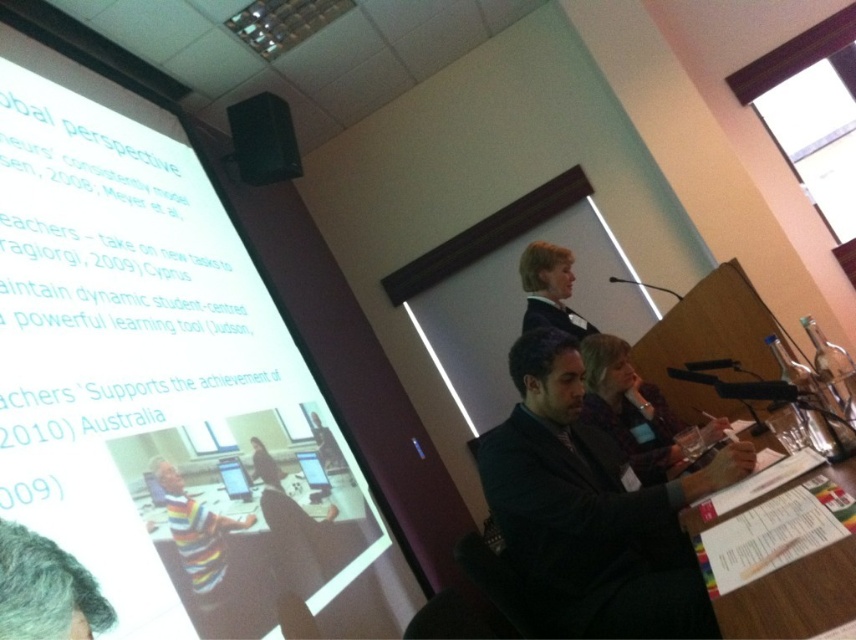
Question: Is plaid fabric shirt at center positioned at the back of black fabric business suit at upper center?

Choices:
 (A) yes
 (B) no

Answer: (B)

Question: Which object is positioned closest to the plaid fabric shirt at center?

Choices:
 (A) matte black laptop at center
 (B) green fuzzy hair at upper left
 (C) white matte projection screen at upper left

Answer: (A)

Question: Which of the following is the closest to the observer?

Choices:
 (A) black matte speaker at upper left
 (B) matte black laptop at center
 (C) dark gray suit at lower right

Answer: (C)

Question: Does wooden table at center appear on the left side of plaid fabric shirt at center?

Choices:
 (A) no
 (B) yes

Answer: (B)

Question: Does white matte projection screen at upper left appear on the left side of plaid fabric shirt at center?

Choices:
 (A) no
 (B) yes

Answer: (B)

Question: Among these objects, which one is nearest to the camera?

Choices:
 (A) black matte speaker at upper left
 (B) wooden table at center
 (C) black fabric business suit at upper center
 (D) green fuzzy hair at upper left

Answer: (D)